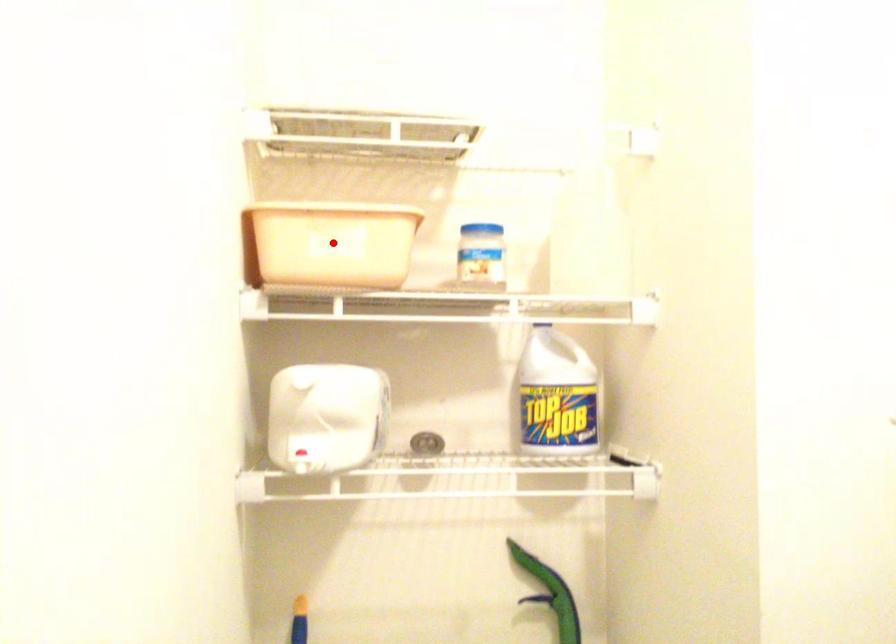
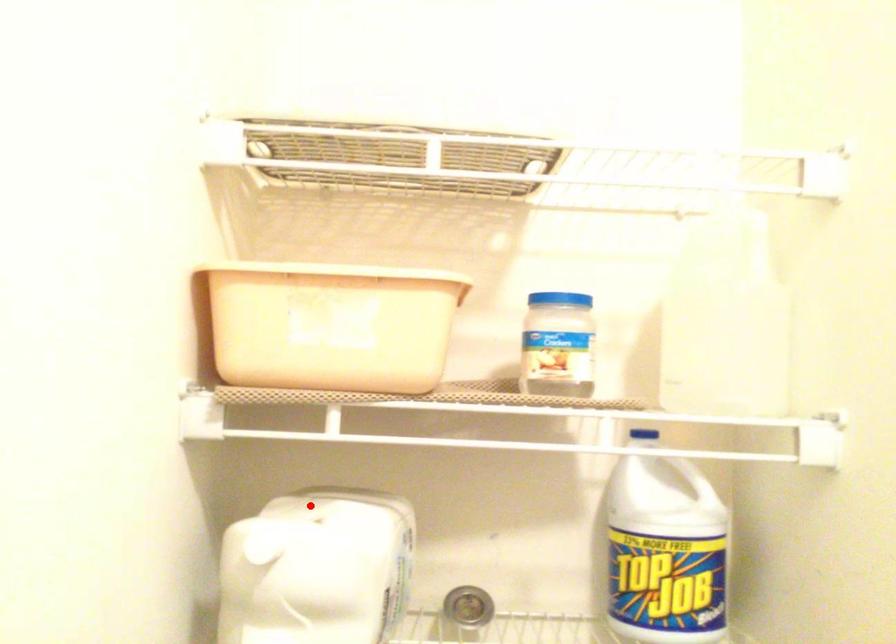
I am providing you with two images of the same scene from different viewpoints. A red point is marked on the first image and another point is marked on the second image. Is the marked point in image1 the same physical position as the marked point in image2?

No